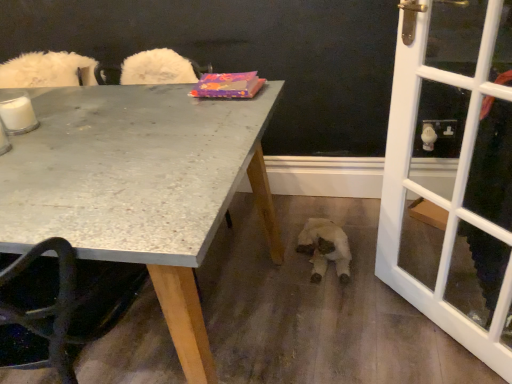
Identify the location of free space between white glass screen door at right and white plush toy at lower center. (377, 292).